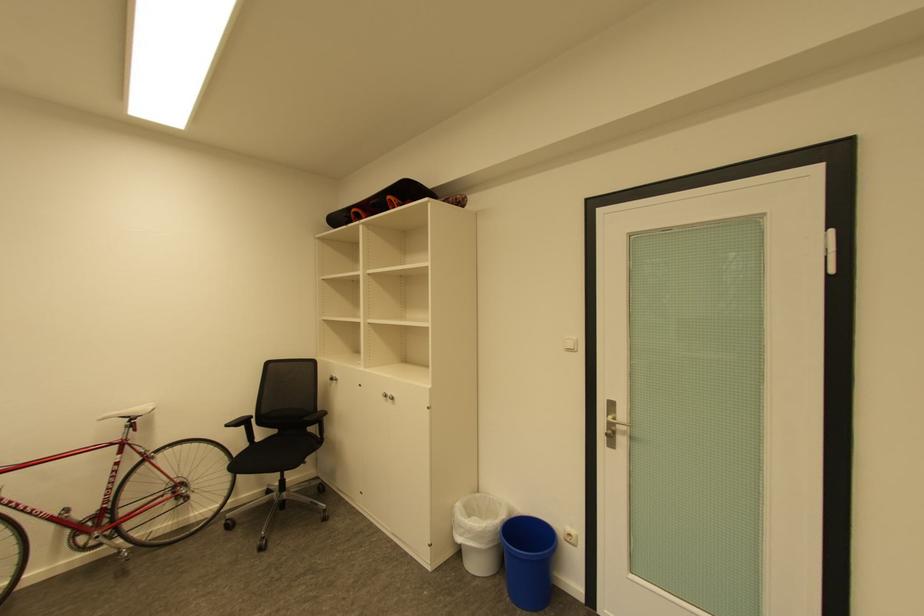
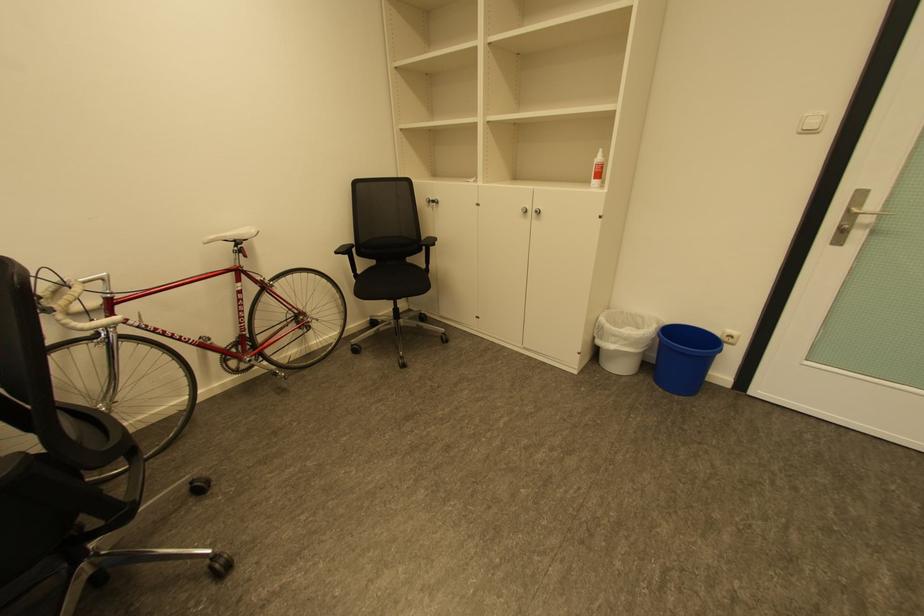
Where in the second image is the point corresponding to point (282, 432) from the first image?

(380, 262)